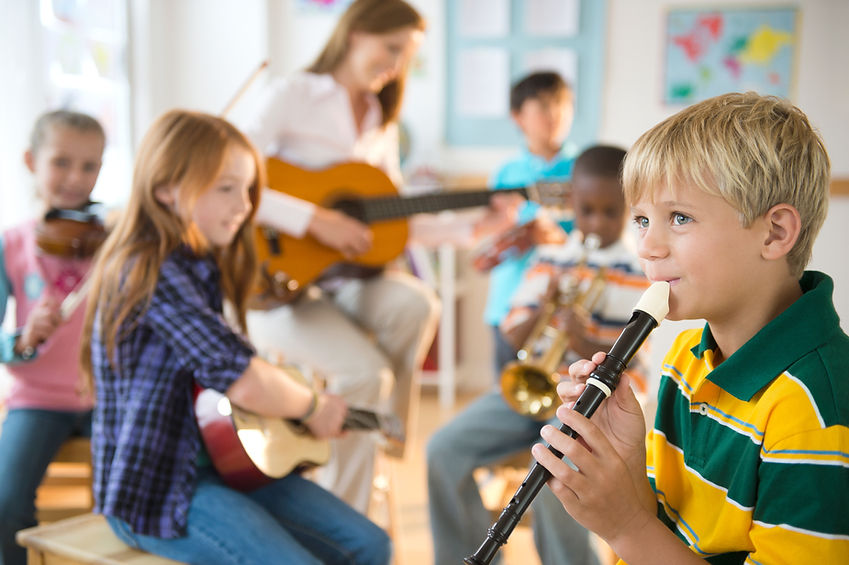
You are a GUI agent. You are given a task and a screenshot of the screen. Output one action in this format:
    pyautogui.click(x=<x>, y=<y>)
    Task: Click on the light shining through window
    The height and width of the screenshot is (565, 849).
    Given the screenshot: What is the action you would take?
    pyautogui.click(x=55, y=27), pyautogui.click(x=244, y=34), pyautogui.click(x=114, y=98)